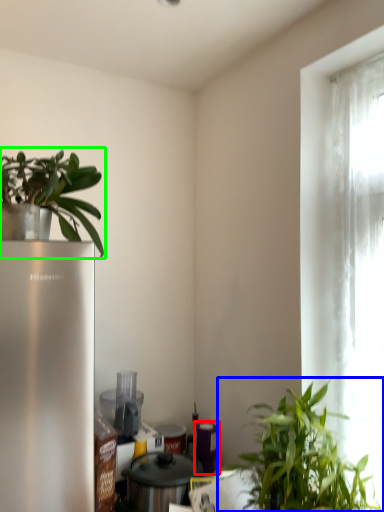
Question: Which is nearer to the appliance (highlighted by a red box)? houseplant (highlighted by a blue box) or houseplant (highlighted by a green box).

Choices:
 (A) houseplant
 (B) houseplant

Answer: (A)